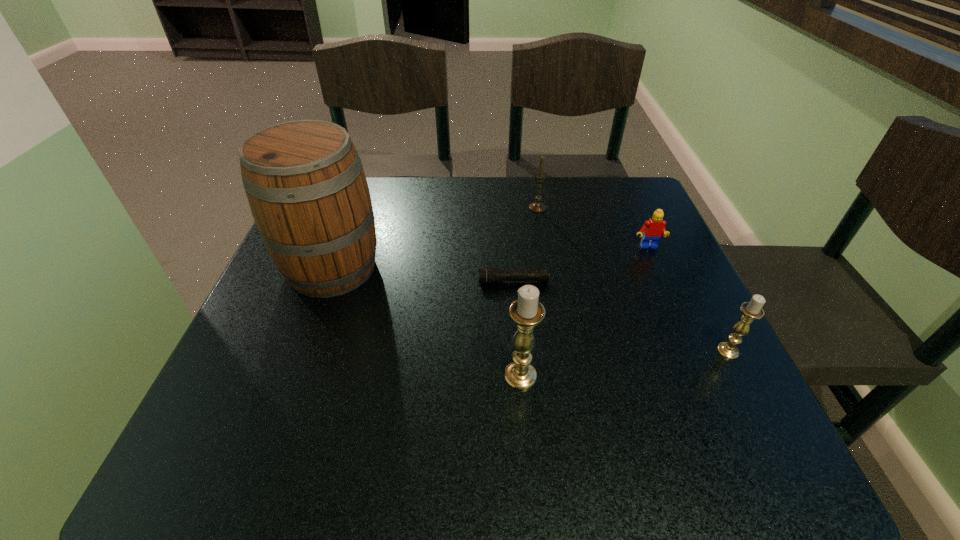
This screenshot has width=960, height=540. Find the location of `vacant place for an extra candle holder on the left`. vacant place for an extra candle holder on the left is located at coordinates (291, 403).